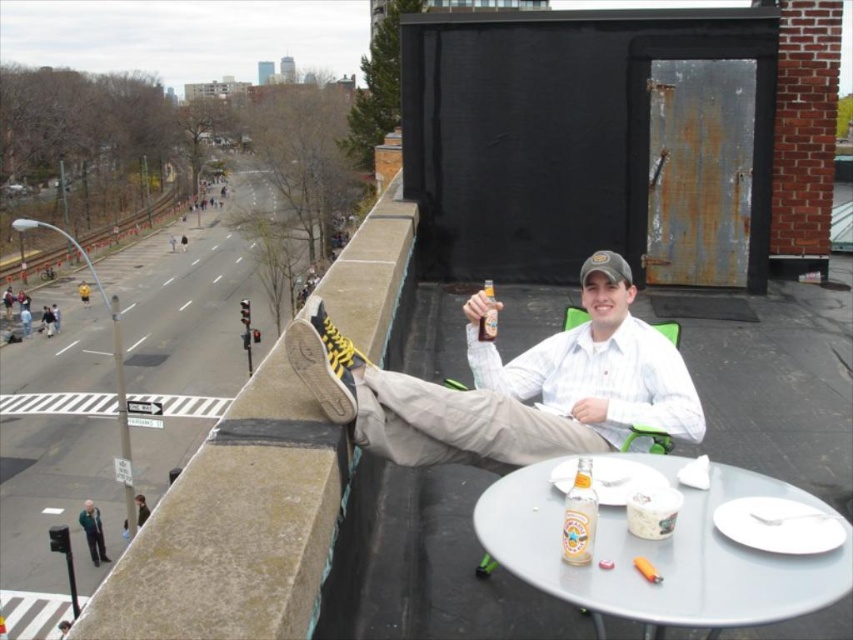
Does brown concrete ledge at upper left have a smaller size compared to metallic gray table at center?

Actually, brown concrete ledge at upper left might be larger than metallic gray table at center.

Is point (314, 534) behind point (648, 598)?

Yes, it is behind point (648, 598).

The width and height of the screenshot is (853, 640). What do you see at coordinates (235, 525) in the screenshot? I see `brown concrete ledge at upper left` at bounding box center [235, 525].

At what (x,y) coordinates should I click in order to perform the action: click on brown concrete ledge at upper left. Please return your answer as a coordinate pair (x, y). Image resolution: width=853 pixels, height=640 pixels. Looking at the image, I should click on (235, 525).

Can you confirm if brown concrete ledge at upper left is positioned below green fabric jacket at lower left?

Incorrect, brown concrete ledge at upper left is not positioned below green fabric jacket at lower left.

Find the location of a particular element. This screenshot has height=640, width=853. brown concrete ledge at upper left is located at coordinates (235, 525).

Image resolution: width=853 pixels, height=640 pixels. I want to click on brown concrete ledge at upper left, so click(235, 525).

The height and width of the screenshot is (640, 853). Find the location of `brown concrete ledge at upper left`. brown concrete ledge at upper left is located at coordinates (235, 525).

Is metallic gray table at center taller than translucent glass beer bottle at upper center?

Correct, metallic gray table at center is much taller as translucent glass beer bottle at upper center.

Does point (660, 468) lie in front of point (490, 340)?

Yes, it is.

Locate an element on the screen. This screenshot has width=853, height=640. metallic gray table at center is located at coordinates (660, 556).